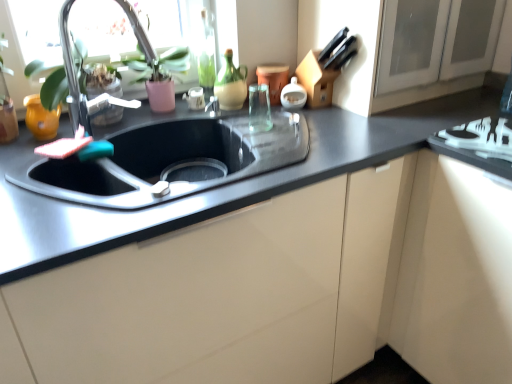
Question: Is black granite countertop at center bigger than matte white cabinet at center?

Choices:
 (A) yes
 (B) no

Answer: (B)

Question: From a real-world perspective, is black granite countertop at center physically below matte white cabinet at center?

Choices:
 (A) yes
 (B) no

Answer: (B)

Question: Does black granite countertop at center have a smaller size compared to matte white cabinet at center?

Choices:
 (A) yes
 (B) no

Answer: (A)

Question: Considering the relative sizes of black granite countertop at center and matte white cabinet at center in the image provided, is black granite countertop at center taller than matte white cabinet at center?

Choices:
 (A) yes
 (B) no

Answer: (B)

Question: Can you see black granite countertop at center touching matte white cabinet at center?

Choices:
 (A) yes
 (B) no

Answer: (B)

Question: From the image's perspective, is matte glass window screen at upper left above or below white glossy soap dispenser at upper center, which is the 4th appliance from left to right?

Choices:
 (A) above
 (B) below

Answer: (B)

Question: Is matte glass window screen at upper left inside or outside of white glossy soap dispenser at upper center, which is the 4th appliance from left to right?

Choices:
 (A) inside
 (B) outside

Answer: (B)

Question: Is matte glass window screen at upper left to the left or to the right of white glossy soap dispenser at upper center, which is the 4th appliance from left to right, in the image?

Choices:
 (A) left
 (B) right

Answer: (A)

Question: Based on their sizes in the image, would you say matte glass window screen at upper left is bigger or smaller than white glossy soap dispenser at upper center, which is the 4th appliance from left to right?

Choices:
 (A) big
 (B) small

Answer: (A)

Question: Do you think white glossy soap dispenser at upper center, which is the 4th appliance from left to right, is within matte glass window screen at upper left, or outside of it?

Choices:
 (A) inside
 (B) outside

Answer: (B)

Question: Does point (302, 100) appear closer or farther from the camera than point (159, 31)?

Choices:
 (A) farther
 (B) closer

Answer: (B)

Question: From their relative heights in the image, would you say white glossy soap dispenser at upper center, acting as the 1th appliance starting from the right, is taller or shorter than matte glass window screen at upper left?

Choices:
 (A) tall
 (B) short

Answer: (B)

Question: Is white glossy soap dispenser at upper center, acting as the 1th appliance starting from the right, in front of or behind matte glass window screen at upper left in the image?

Choices:
 (A) front
 (B) behind

Answer: (B)

Question: Considering their positions, is white glossy stove at lower right located in front of or behind matte glass window screen at upper left?

Choices:
 (A) front
 (B) behind

Answer: (A)

Question: From the image's perspective, relative to matte glass window screen at upper left, is white glossy stove at lower right above or below?

Choices:
 (A) below
 (B) above

Answer: (A)